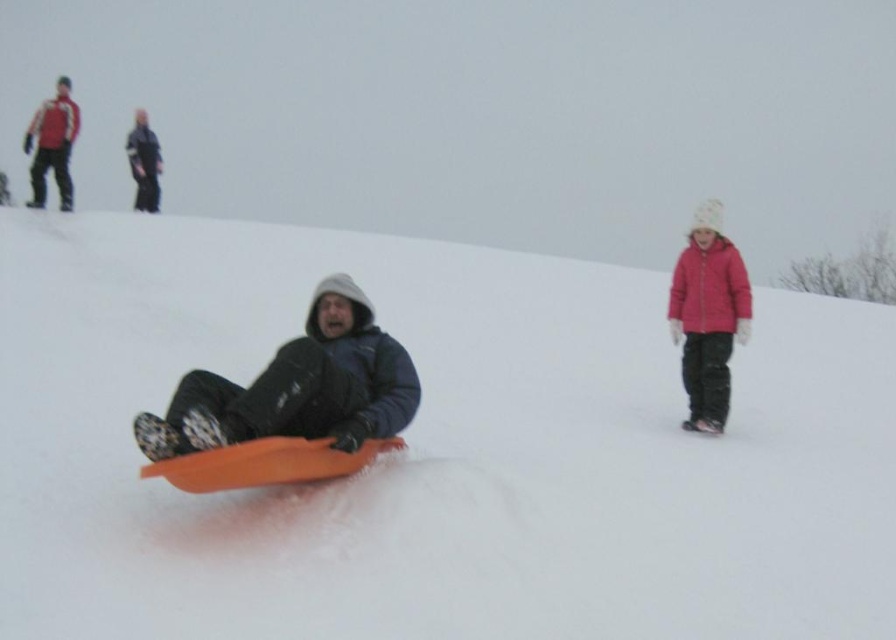
Question: Can you confirm if matte black jacket at center is positioned to the left of matte pink jacket at right?

Choices:
 (A) no
 (B) yes

Answer: (B)

Question: Which point is closer to the camera?

Choices:
 (A) (142, 227)
 (B) (76, 106)
 (C) (141, 148)
 (D) (222, 390)

Answer: (D)

Question: Does white matte snow at center come behind brushed metal jacket at upper left?

Choices:
 (A) yes
 (B) no

Answer: (B)

Question: Among these points, which one is nearest to the camera?

Choices:
 (A) click(x=345, y=285)
 (B) click(x=42, y=109)
 (C) click(x=869, y=307)
 (D) click(x=143, y=205)

Answer: (A)

Question: Which object appears closest to the camera in this image?

Choices:
 (A) brushed metal jacket at upper left
 (B) white matte snow at center
 (C) matte pink jacket at right

Answer: (B)

Question: Is matte black jacket at center to the left of dark blue jacket at upper left from the viewer's perspective?

Choices:
 (A) no
 (B) yes

Answer: (A)